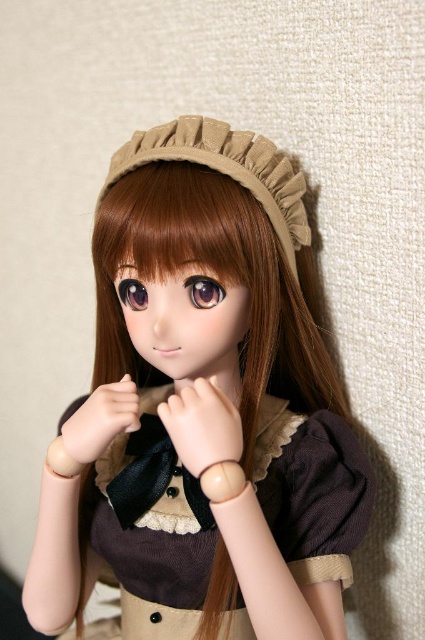
Question: Can you confirm if brown corduroy dress at center is bigger than matte brown hand at center?

Choices:
 (A) no
 (B) yes

Answer: (B)

Question: Which object appears closest to the camera in this image?

Choices:
 (A) glossy purple eye at center
 (B) matte brown dress at center

Answer: (B)

Question: Can you confirm if beige fabric headband at upper center is bigger than glossy purple eye at center?

Choices:
 (A) no
 (B) yes

Answer: (B)

Question: Can you confirm if matte brown hand at center is bigger than glossy purple eye at center?

Choices:
 (A) no
 (B) yes

Answer: (B)

Question: Which object is positioned closest to the purple glossy eye at center?

Choices:
 (A) glossy purple eye at center
 (B) matte brown dress at center
 (C) matte brown hand at center
 (D) beige fabric headband at upper center

Answer: (A)

Question: Which object is the closest to the purple glossy eye at center?

Choices:
 (A) matte brown hand at center
 (B) beige fabric headband at upper center

Answer: (A)